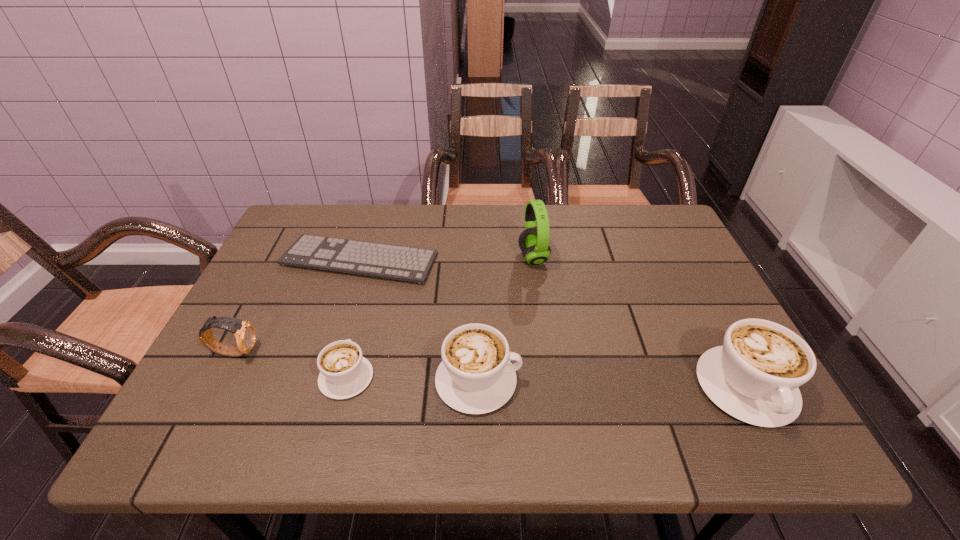
The width and height of the screenshot is (960, 540). In order to click on free space between the rightmost object and the third object from right to left in this screenshot , I will do `click(612, 384)`.

This screenshot has height=540, width=960. What are the coordinates of `empty space that is in between the computer keyboard and the fifth tallest object` in the screenshot? It's located at (353, 318).

Find the location of a particular element. This screenshot has height=540, width=960. vacant area that lies between the rightmost object and the third object from right to left is located at coordinates (612, 384).

The image size is (960, 540). What are the coordinates of `free space that is in between the second shortest object and the second shortest cappuccino` in the screenshot? It's located at (x=412, y=379).

What are the coordinates of `free space between the rightmost cappuccino and the headset` in the screenshot? It's located at (640, 323).

You are a GUI agent. You are given a task and a screenshot of the screen. Output one action in this format:
    pyautogui.click(x=<x>, y=<y>)
    Task: Click on the vacant space that's between the third object from right to left and the leftmost cappuccino
    This screenshot has width=960, height=540.
    Given the screenshot: What is the action you would take?
    pyautogui.click(x=412, y=379)

The image size is (960, 540). In order to click on vacant area that lies between the computer keyboard and the rightmost object in this screenshot , I will do `click(553, 324)`.

Where is `object that is the fifth closest to the rightmost object`? Image resolution: width=960 pixels, height=540 pixels. object that is the fifth closest to the rightmost object is located at coordinates (245, 333).

This screenshot has width=960, height=540. I want to click on object identified as the closest to the watch, so click(x=344, y=372).

Identify which cappuccino is the nearest to the rightmost cappuccino. Please provide its 2D coordinates. Your answer should be formatted as a tuple, i.e. [(x, y)], where the tuple contains the x and y coordinates of a point satisfying the conditions above.

[(475, 376)]